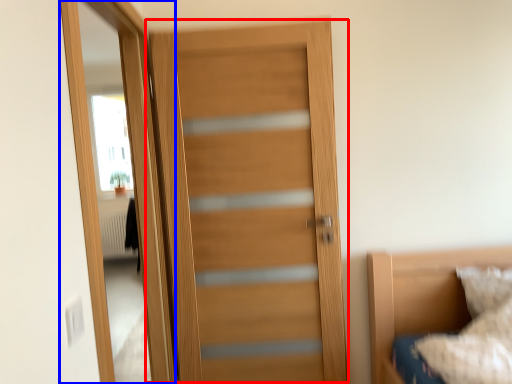
Question: Which object appears closest to the camera in this image, door (highlighted by a red box) or screen door (highlighted by a blue box)?

Choices:
 (A) door
 (B) screen door

Answer: (B)